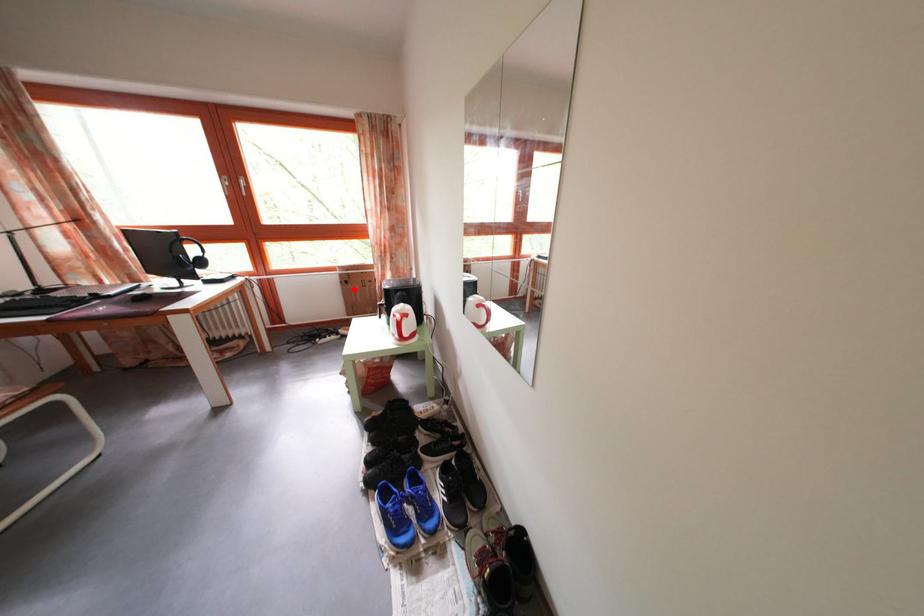
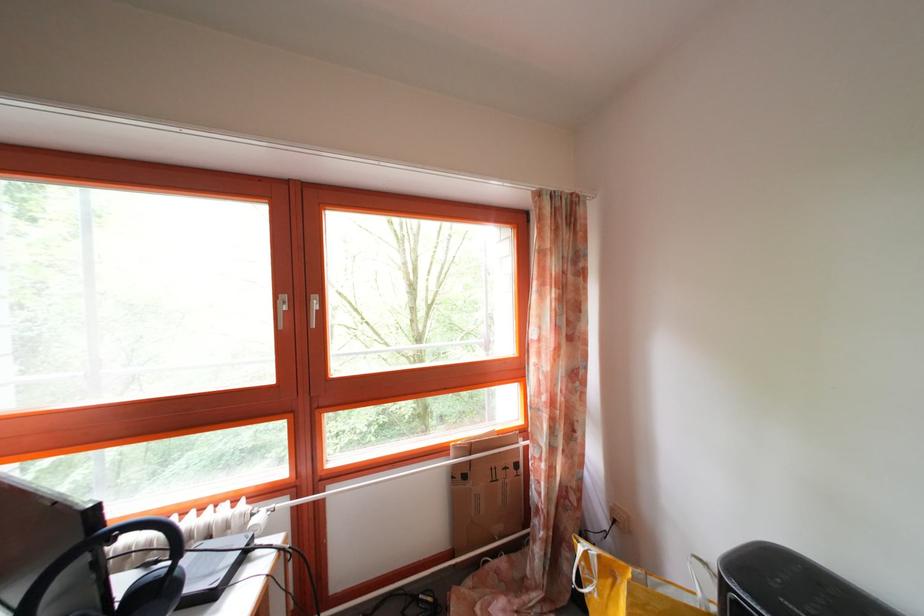
Find the pixel in the second image that matches the highlighted location in the first image.

(472, 484)